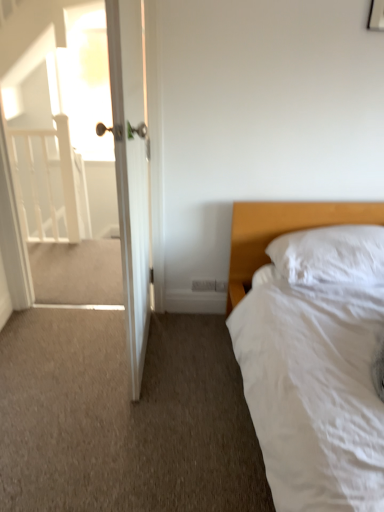
Describe the element at coordinates (47, 180) in the screenshot. I see `white wooden balustrade at left` at that location.

You are a GUI agent. You are given a task and a screenshot of the screen. Output one action in this format:
    pyautogui.click(x=<x>, y=<y>)
    Task: Click on the white soft pillow at right
    
    Given the screenshot: What is the action you would take?
    pyautogui.click(x=330, y=254)

Which is more to the right, white wooden door at left or white soft bed at right?

From the viewer's perspective, white soft bed at right appears more on the right side.

How many degrees apart are the facing directions of white wooden door at left and white soft bed at right?

The facing directions of white wooden door at left and white soft bed at right are 89.7 degrees apart.

Does point (144, 156) come behind point (294, 212)?

No, (144, 156) is in front of (294, 212).

Is white wooden door at left looking in the opposite direction of white soft bed at right?

Yes.

Which of these two, white soft pillow at right or white soft bed at right, is smaller?

Smaller between the two is white soft pillow at right.

Considering the positions of objects white soft pillow at right and white soft bed at right in the image provided, who is in front, white soft pillow at right or white soft bed at right?

white soft bed at right.

From the image's perspective, would you say white soft pillow at right is positioned over white soft bed at right?

Yes, from the image's perspective, white soft pillow at right is above white soft bed at right.

Would you say white soft pillow at right contains white wooden door at left?

No, white wooden door at left is located outside of white soft pillow at right.

In order to click on pillow that is on the right side of white wooden door at left in this screenshot , I will do `click(330, 254)`.

Considering the positions of objects white soft pillow at right and white wooden door at left in the image provided, who is behind, white soft pillow at right or white wooden door at left?

white soft pillow at right is behind.

From a real-world perspective, is white soft pillow at right positioned above or below white wooden door at left?

white soft pillow at right is situated lower than white wooden door at left in the real world.

From the image's perspective, is white soft bed at right located above white wooden balustrade at left?

Incorrect, from the image's perspective, white soft bed at right is lower than white wooden balustrade at left.

Is point (317, 209) in front of point (16, 170)?

That is True.

From a real-world perspective, which object stands above the other?

white wooden balustrade at left, from a real-world perspective.

From a real-world perspective, between white wooden door at left and white soft pillow at right, who is vertically lower?

From a 3D spatial view, white soft pillow at right is below.

Which is nearer, (131, 383) or (346, 269)?

Point (131, 383).

Where is `pillow beneath the white wooden door at left (from a real-world perspective)`? Image resolution: width=384 pixels, height=512 pixels. pillow beneath the white wooden door at left (from a real-world perspective) is located at coordinates (330, 254).

Is white wooden door at left taller or shorter than white soft pillow at right?

Considering their sizes, white wooden door at left has more height than white soft pillow at right.

Based on the photo, is white wooden balustrade at left not near white glossy door at upper left?

No, there isn't a large distance between white wooden balustrade at left and white glossy door at upper left.

From the image's perspective, between white wooden balustrade at left and white glossy door at upper left, who is located below?

white glossy door at upper left.

Is point (62, 149) positioned behind point (67, 115)?

No, it is not.

Which of these two, white wooden balustrade at left or white glossy door at upper left, stands taller?

With more height is white glossy door at upper left.

Find the location of a particular element. pillow lying in front of the white wooden balustrade at left is located at coordinates (330, 254).

How different are the orientations of white soft pillow at right and white wooden balustrade at left in degrees?

They differ by 0.678 degrees in their facing directions.

Who is shorter, white soft pillow at right or white wooden balustrade at left?

white soft pillow at right.

Is white soft pillow at right in front of white wooden balustrade at left?

Yes, white soft pillow at right is in front of white wooden balustrade at left.

The width and height of the screenshot is (384, 512). What are the coordinates of `door that appears on the left of white soft bed at right` in the screenshot? It's located at (131, 170).

This screenshot has height=512, width=384. In order to click on pillow behind the white soft bed at right in this screenshot , I will do `click(330, 254)`.

Which object lies further to the anchor point white soft bed at right, white wooden door at left or white glossy door at upper left?

white glossy door at upper left is positioned further to the anchor white soft bed at right.

Which object lies further to the anchor point white wooden door at left, white soft pillow at right or white glossy door at upper left?

The object further to white wooden door at left is white glossy door at upper left.

From the image, which object appears to be nearer to white soft bed at right, white soft pillow at right or white glossy door at upper left?

white soft pillow at right lies closer to white soft bed at right than the other object.

When comparing their distances from white soft bed at right, does white wooden door at left or white wooden balustrade at left seem closer?

Among the two, white wooden door at left is located nearer to white soft bed at right.

Looking at this image, from the image, which object appears to be nearer to white wooden balustrade at left, white soft pillow at right or white soft bed at right?

Based on the image, white soft bed at right appears to be nearer to white wooden balustrade at left.

Considering their positions, is white wooden door at left positioned further to white wooden balustrade at left than white soft pillow at right?

white soft pillow at right is positioned further to the anchor white wooden balustrade at left.

Looking at the image, which one is located further to white glossy door at upper left, white soft bed at right or white wooden balustrade at left?

The object further to white glossy door at upper left is white soft bed at right.

In the scene shown: From the image, which object appears to be nearer to white wooden balustrade at left, white glossy door at upper left or white soft pillow at right?

Among the two, white glossy door at upper left is located nearer to white wooden balustrade at left.

The height and width of the screenshot is (512, 384). What are the coordinates of `bed between white glossy door at upper left and white soft pillow at right from left to right` in the screenshot? It's located at (282, 232).

The width and height of the screenshot is (384, 512). Identify the location of door between white wooden balustrade at left and white soft pillow at right. (131, 170).

You are a GUI agent. You are given a task and a screenshot of the screen. Output one action in this format:
    pyautogui.click(x=<x>, y=<y>)
    Task: Click on the screen door between white wooden balustrade at left and white soft pillow at right from left to right
    This screenshot has width=384, height=512.
    Given the screenshot: What is the action you would take?
    pyautogui.click(x=77, y=153)

I want to click on screen door located between white soft bed at right and white wooden balustrade at left in the depth direction, so click(x=77, y=153).